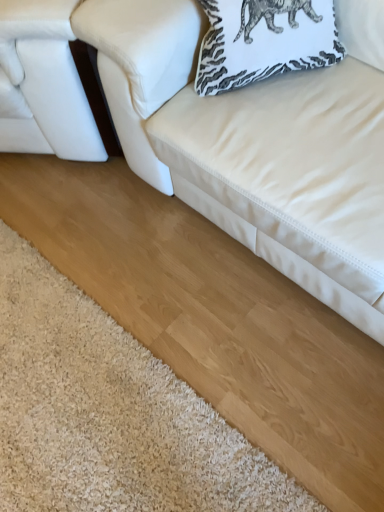
In order to face white shaggy rug at lower left, should I rotate leftwards or rightwards?

It's best to rotate left around 17.563 degrees.

What is the approximate width of white shaggy rug at lower left?

The width of white shaggy rug at lower left is 4.46 feet.

In order to click on white leather studio couch at left, which appears as the 2th studio couch when viewed from the right in this screenshot , I will do `click(43, 83)`.

What do you see at coordinates (43, 83) in the screenshot?
I see `white leather studio couch at left, which is the first studio couch from left to right` at bounding box center [43, 83].

Where is `white printed pillow at upper right`? white printed pillow at upper right is located at coordinates (264, 41).

Where is `white leather couch at upper right, the 1th studio couch viewed from the right`? Image resolution: width=384 pixels, height=512 pixels. white leather couch at upper right, the 1th studio couch viewed from the right is located at coordinates (254, 150).

Identify the location of white shaggy rug at lower left. (109, 413).

Where is `mat in front of the white printed pillow at upper right`? The width and height of the screenshot is (384, 512). mat in front of the white printed pillow at upper right is located at coordinates (109, 413).

Who is bigger, white shaggy rug at lower left or white printed pillow at upper right?

Bigger between the two is white shaggy rug at lower left.

Is white shaggy rug at lower left not near white printed pillow at upper right?

white shaggy rug at lower left is actually quite close to white printed pillow at upper right.

Where is `pillow below the white leather studio couch at left, which is the first studio couch from left to right (from the image's perspective)`? The width and height of the screenshot is (384, 512). pillow below the white leather studio couch at left, which is the first studio couch from left to right (from the image's perspective) is located at coordinates (264, 41).

Does white leather studio couch at left, which is the first studio couch from left to right, have a lesser height compared to white printed pillow at upper right?

In fact, white leather studio couch at left, which is the first studio couch from left to right, may be taller than white printed pillow at upper right.

Can you confirm if white leather studio couch at left, which appears as the 2th studio couch when viewed from the right, is thinner than white printed pillow at upper right?

Incorrect, the width of white leather studio couch at left, which appears as the 2th studio couch when viewed from the right, is not less than that of white printed pillow at upper right.

Can you confirm if white printed pillow at upper right is bigger than white shaggy rug at lower left?

No, white printed pillow at upper right is not bigger than white shaggy rug at lower left.

Does white printed pillow at upper right turn towards white shaggy rug at lower left?

No, white printed pillow at upper right is not turned towards white shaggy rug at lower left.

What's the angular difference between white printed pillow at upper right and white shaggy rug at lower left's facing directions?

white printed pillow at upper right and white shaggy rug at lower left are facing 146 degrees away from each other.

Considering the relative sizes of white printed pillow at upper right and white shaggy rug at lower left in the image provided, is white printed pillow at upper right wider than white shaggy rug at lower left?

No.

Is white leather couch at upper right, the 1th studio couch viewed from the right, outside of white printed pillow at upper right?

white leather couch at upper right, the 1th studio couch viewed from the right, is positioned outside white printed pillow at upper right.

From a real-world perspective, is white leather couch at upper right, which is the 2th studio couch in left-to-right order, located higher than white printed pillow at upper right?

No.

Does point (172, 82) come farther from viewer compared to point (234, 39)?

Yes, point (172, 82) is behind point (234, 39).

Would you say white leather studio couch at left, which is the first studio couch from left to right, is outside white shaggy rug at lower left?

Yes, white leather studio couch at left, which is the first studio couch from left to right, is not within white shaggy rug at lower left.

Which object is further away from the camera taking this photo, white leather studio couch at left, which is the first studio couch from left to right, or white shaggy rug at lower left?

Positioned behind is white leather studio couch at left, which is the first studio couch from left to right.

Which is behind, point (11, 92) or point (143, 464)?

Point (11, 92)

From the image's perspective, is white leather studio couch at left, which is the first studio couch from left to right, above or below white shaggy rug at lower left?

white leather studio couch at left, which is the first studio couch from left to right, is situated higher than white shaggy rug at lower left in the image.

From a real-world perspective, which is physically below, white leather studio couch at left, which is the first studio couch from left to right, or white leather couch at upper right, which is the 2th studio couch in left-to-right order?

From a 3D spatial view, white leather studio couch at left, which is the first studio couch from left to right, is below.

Is point (35, 64) positioned before point (329, 156)?

No, it is behind (329, 156).

Find the location of a particular element. The height and width of the screenshot is (512, 384). studio couch lying below the white leather studio couch at left, which appears as the 2th studio couch when viewed from the right (from the image's perspective) is located at coordinates (254, 150).

Which point is more distant from viewer, (115, 40) or (11, 25)?

The point (11, 25) is farther.

Which object is closer to the camera taking this photo, white leather couch at upper right, which is the 2th studio couch in left-to-right order, or white leather studio couch at left, which appears as the 2th studio couch when viewed from the right?

Positioned in front is white leather couch at upper right, which is the 2th studio couch in left-to-right order.

Is white leather studio couch at left, which is the first studio couch from left to right, surrounded by white leather couch at upper right, which is the 2th studio couch in left-to-right order?

Definitely not — white leather studio couch at left, which is the first studio couch from left to right, is not inside white leather couch at upper right, which is the 2th studio couch in left-to-right order.

Considering the sizes of objects white leather couch at upper right, the 1th studio couch viewed from the right, and white leather studio couch at left, which is the first studio couch from left to right, in the image provided, who is wider, white leather couch at upper right, the 1th studio couch viewed from the right, or white leather studio couch at left, which is the first studio couch from left to right,?

white leather studio couch at left, which is the first studio couch from left to right, is wider.

This screenshot has height=512, width=384. What are the coordinates of `pillow lying above the white shaggy rug at lower left (from the image's perspective)` in the screenshot? It's located at (264, 41).

Locate an element on the screen. Image resolution: width=384 pixels, height=512 pixels. studio couch behind the white printed pillow at upper right is located at coordinates coord(43,83).

Estimate the real-world distances between objects in this image. Which object is further from white leather studio couch at left, which appears as the 2th studio couch when viewed from the right, white leather couch at upper right, the 1th studio couch viewed from the right, or white printed pillow at upper right?

white printed pillow at upper right is positioned further to the anchor white leather studio couch at left, which appears as the 2th studio couch when viewed from the right.

When comparing their distances from white shaggy rug at lower left, does white leather couch at upper right, the 1th studio couch viewed from the right, or white printed pillow at upper right seem further?

Based on the image, white printed pillow at upper right appears to be further to white shaggy rug at lower left.

Which object lies nearer to the anchor point white leather studio couch at left, which appears as the 2th studio couch when viewed from the right, white shaggy rug at lower left or white printed pillow at upper right?

white printed pillow at upper right lies closer to white leather studio couch at left, which appears as the 2th studio couch when viewed from the right, than the other object.

Looking at the image, which one is located closer to white printed pillow at upper right, white leather studio couch at left, which appears as the 2th studio couch when viewed from the right, or white leather couch at upper right, which is the 2th studio couch in left-to-right order?

white leather couch at upper right, which is the 2th studio couch in left-to-right order, lies closer to white printed pillow at upper right than the other object.

Based on their spatial positions, is white shaggy rug at lower left or white printed pillow at upper right closer to white leather couch at upper right, which is the 2th studio couch in left-to-right order?

white printed pillow at upper right.

From the image, which object appears to be farther from white leather couch at upper right, the 1th studio couch viewed from the right, white printed pillow at upper right or white leather studio couch at left, which is the first studio couch from left to right?

Among the two, white leather studio couch at left, which is the first studio couch from left to right, is located further to white leather couch at upper right, the 1th studio couch viewed from the right.

Looking at the image, which one is located further to white leather studio couch at left, which appears as the 2th studio couch when viewed from the right, white leather couch at upper right, which is the 2th studio couch in left-to-right order, or white shaggy rug at lower left?

white shaggy rug at lower left.

Looking at the image, which one is located further to white shaggy rug at lower left, white leather couch at upper right, the 1th studio couch viewed from the right, or white leather studio couch at left, which appears as the 2th studio couch when viewed from the right?

white leather studio couch at left, which appears as the 2th studio couch when viewed from the right, is positioned further to the anchor white shaggy rug at lower left.

This screenshot has width=384, height=512. Find the location of `studio couch between white printed pillow at upper right and white shaggy rug at lower left in the up-down direction`. studio couch between white printed pillow at upper right and white shaggy rug at lower left in the up-down direction is located at coordinates (254, 150).

This screenshot has height=512, width=384. I want to click on studio couch that lies between white leather studio couch at left, which is the first studio couch from left to right, and white shaggy rug at lower left from top to bottom, so click(254, 150).

Find the location of a particular element. Image resolution: width=384 pixels, height=512 pixels. pillow between white leather studio couch at left, which appears as the 2th studio couch when viewed from the right, and white shaggy rug at lower left vertically is located at coordinates (264, 41).

Identify the location of pillow between white leather studio couch at left, which is the first studio couch from left to right, and white leather couch at upper right, which is the 2th studio couch in left-to-right order. (264, 41).